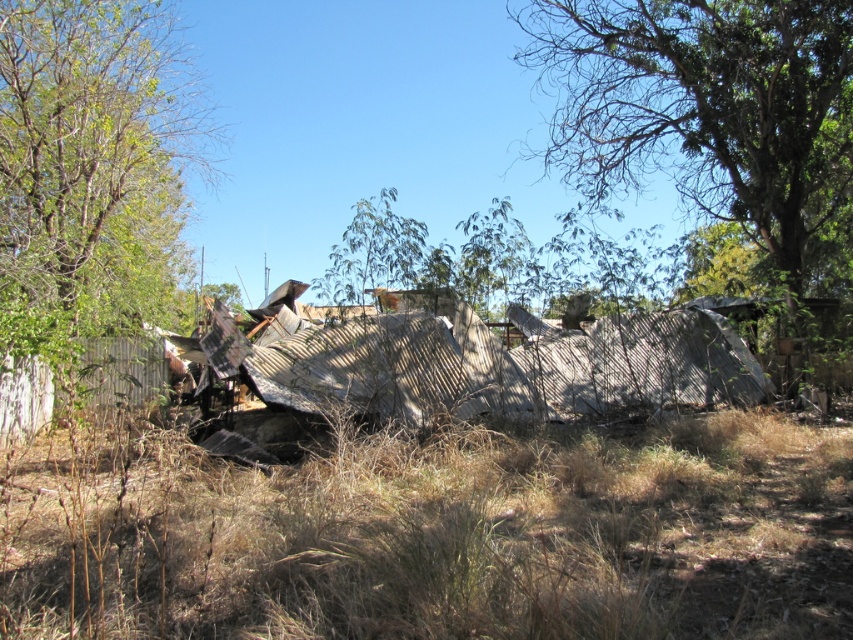
Question: Which object appears farthest from the camera in this image?

Choices:
 (A) corrugated metal hut at center
 (B) green leafy tree at left

Answer: (B)

Question: Does green leafy tree at left appear over corrugated metal hut at center?

Choices:
 (A) no
 (B) yes

Answer: (B)

Question: Can you confirm if green leafy tree at upper right is positioned above green leafy tree at left?

Choices:
 (A) no
 (B) yes

Answer: (B)

Question: Does brown dry grass at center appear on the right side of corrugated metal hut at center?

Choices:
 (A) yes
 (B) no

Answer: (A)

Question: Which object is the closest to the brown dry grass at center?

Choices:
 (A) green leafy tree at upper right
 (B) corrugated metal hut at center

Answer: (B)

Question: Among these points, which one is nearest to the camera?

Choices:
 (A) (564, 460)
 (B) (665, 104)
 (C) (677, 369)

Answer: (A)